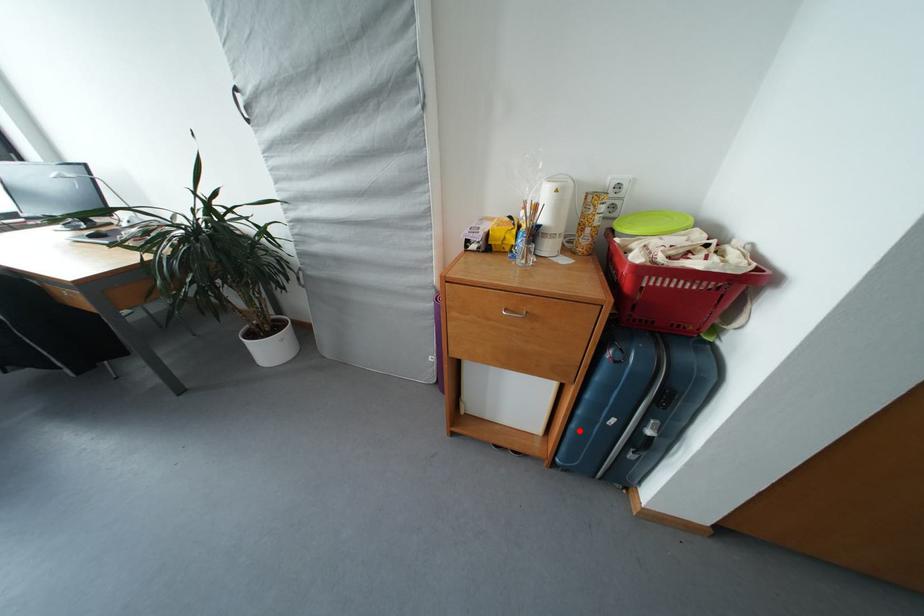
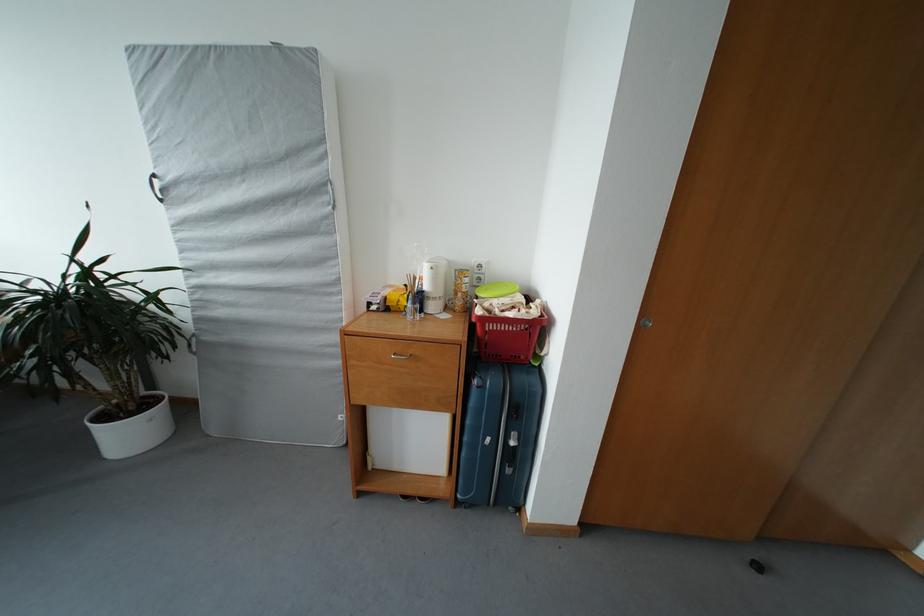
Question: I am providing you with two images of the same scene from different viewpoints. A red point is shown in image1. For the corresponding object point in image2, is it positioned nearer or farther from the camera?

Choices:
 (A) Nearer
 (B) Farther

Answer: (B)